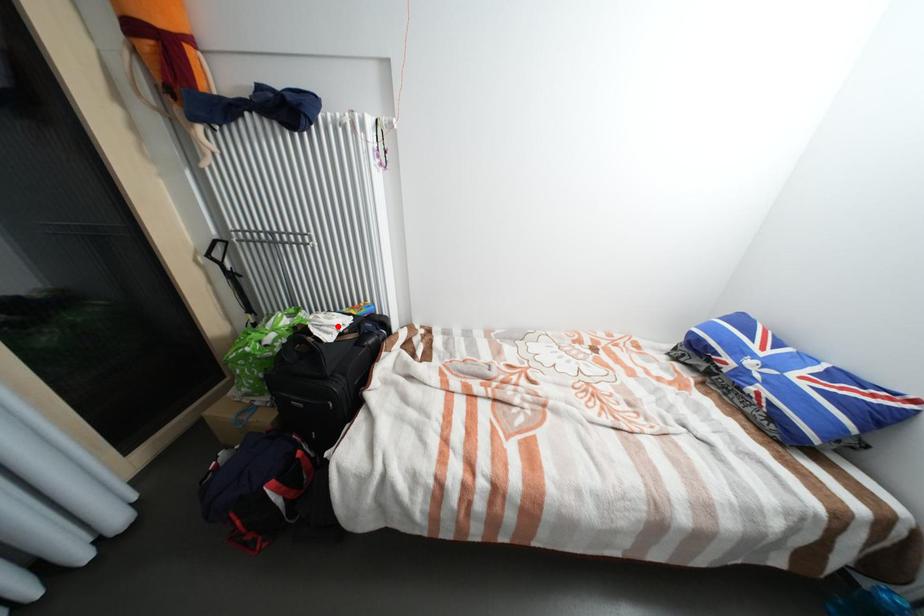
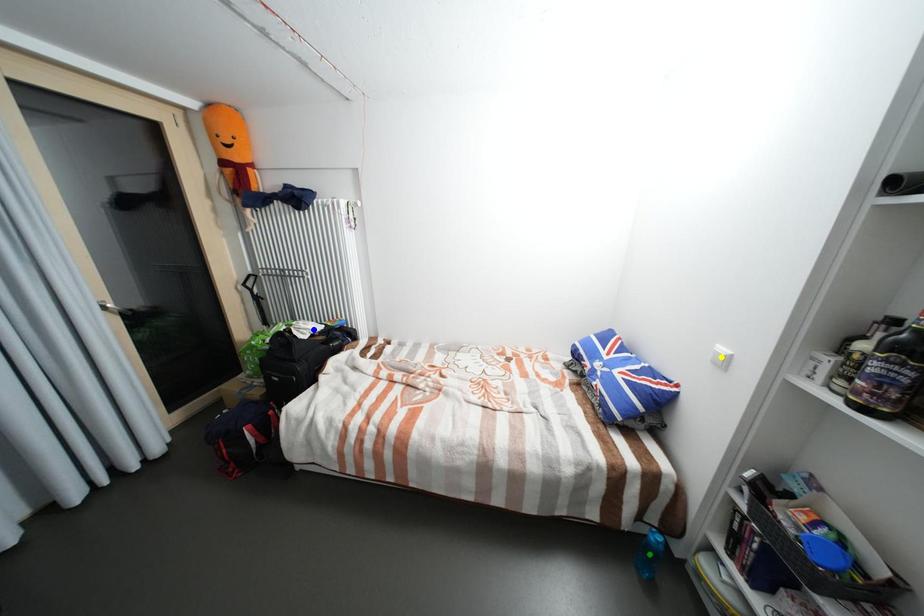
Question: I am providing you with two images of the same scene from different viewpoints. A red point is marked on the first image. You are given multiple points on the second image. Can you choose the point in image 2 that corresponds to the point in image 1?

Choices:
 (A) green point
 (B) blue point
 (C) yellow point

Answer: (B)